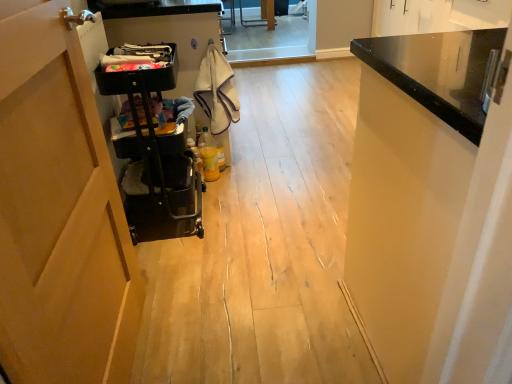
Question: Considering the relative positions of black plastic trolley at left and black fabric laundry at upper center, which is the first laundry from left to right, in the image provided, is black plastic trolley at left to the right of black fabric laundry at upper center, which is the first laundry from left to right, from the viewer's perspective?

Choices:
 (A) no
 (B) yes

Answer: (B)

Question: Does black plastic trolley at left have a lesser width compared to black fabric laundry at upper center, which is the 1th laundry in front-to-back order?

Choices:
 (A) yes
 (B) no

Answer: (B)

Question: From the image's perspective, is black plastic trolley at left beneath black fabric laundry at upper center, which is the 1th laundry in front-to-back order?

Choices:
 (A) yes
 (B) no

Answer: (A)

Question: From a real-world perspective, is black plastic trolley at left over black fabric laundry at upper center, which is the first laundry from left to right?

Choices:
 (A) yes
 (B) no

Answer: (B)

Question: Is black plastic trolley at left to the left of black fabric laundry at upper center, which is the first laundry from left to right, from the viewer's perspective?

Choices:
 (A) yes
 (B) no

Answer: (B)

Question: Is black glossy cabinet at upper right spatially inside black fabric laundry at upper center, the second laundry viewed from the back, or outside of it?

Choices:
 (A) outside
 (B) inside

Answer: (A)

Question: Is black glossy cabinet at upper right to the left or to the right of black fabric laundry at upper center, which is the 1th laundry in front-to-back order, in the image?

Choices:
 (A) left
 (B) right

Answer: (B)

Question: From a real-world perspective, is black glossy cabinet at upper right above or below black fabric laundry at upper center, the second laundry viewed from the back?

Choices:
 (A) below
 (B) above

Answer: (A)

Question: Considering their positions, is black glossy cabinet at upper right located in front of or behind black fabric laundry at upper center, which is the 1th laundry in front-to-back order?

Choices:
 (A) behind
 (B) front

Answer: (B)

Question: Is black fabric laundry at upper center, which is the first laundry from left to right, spatially inside black glossy cabinet at upper right, or outside of it?

Choices:
 (A) inside
 (B) outside

Answer: (B)

Question: Considering the positions of black fabric laundry at upper center, the second laundry viewed from the back, and black glossy cabinet at upper right in the image, is black fabric laundry at upper center, the second laundry viewed from the back, taller or shorter than black glossy cabinet at upper right?

Choices:
 (A) short
 (B) tall

Answer: (A)

Question: Based on their sizes in the image, would you say black fabric laundry at upper center, which is the first laundry from left to right, is bigger or smaller than black glossy cabinet at upper right?

Choices:
 (A) small
 (B) big

Answer: (A)

Question: From a real-world perspective, is black fabric laundry at upper center, the second laundry viewed from the right, physically located above or below black glossy cabinet at upper right?

Choices:
 (A) above
 (B) below

Answer: (A)

Question: From their relative heights in the image, would you say black fabric laundry at upper center, the second laundry viewed from the right, is taller or shorter than white cotton towel at center, which is counted as the 1th laundry, starting from the right?

Choices:
 (A) short
 (B) tall

Answer: (A)

Question: In the image, is black fabric laundry at upper center, the second laundry viewed from the back, positioned in front of or behind white cotton towel at center, which appears as the second laundry when viewed from the left?

Choices:
 (A) behind
 (B) front

Answer: (B)